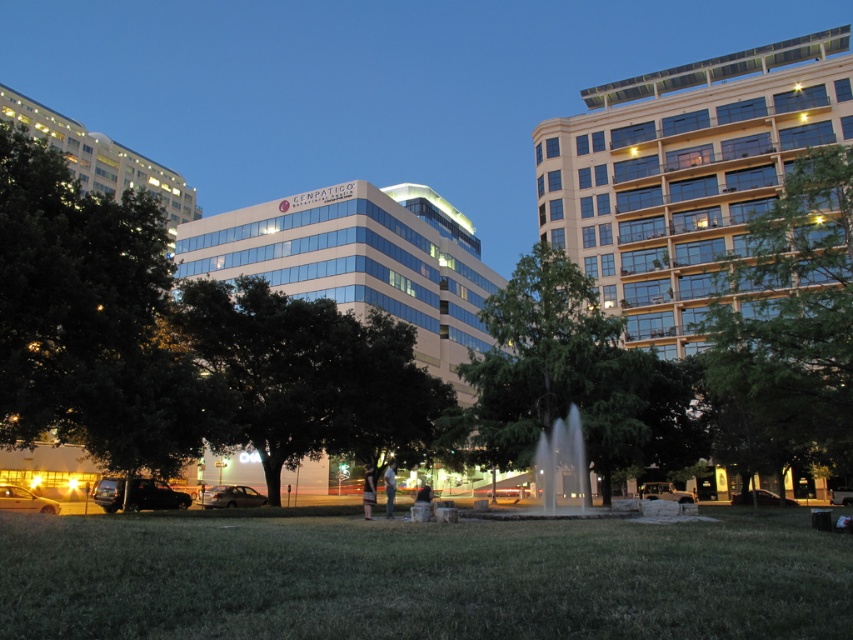
Question: Which point is closer to the camera taking this photo?

Choices:
 (A) (793, 129)
 (B) (540, 404)
 (C) (299, 214)

Answer: (B)

Question: Can you confirm if green leafy tree at center is positioned above white glass building at upper left?

Choices:
 (A) yes
 (B) no

Answer: (B)

Question: Which point appears farthest from the camera in this image?

Choices:
 (A) (76, 125)
 (B) (787, 218)

Answer: (A)

Question: Which object is farther from the camera taking this photo?

Choices:
 (A) white glass building at center
 (B) gold glass building at upper right
 (C) green leafy tree at right

Answer: (B)

Question: Does green leafy tree at right lie behind white glass building at center?

Choices:
 (A) yes
 (B) no

Answer: (B)

Question: Is gold glass building at upper right wider than white glass building at center?

Choices:
 (A) no
 (B) yes

Answer: (A)